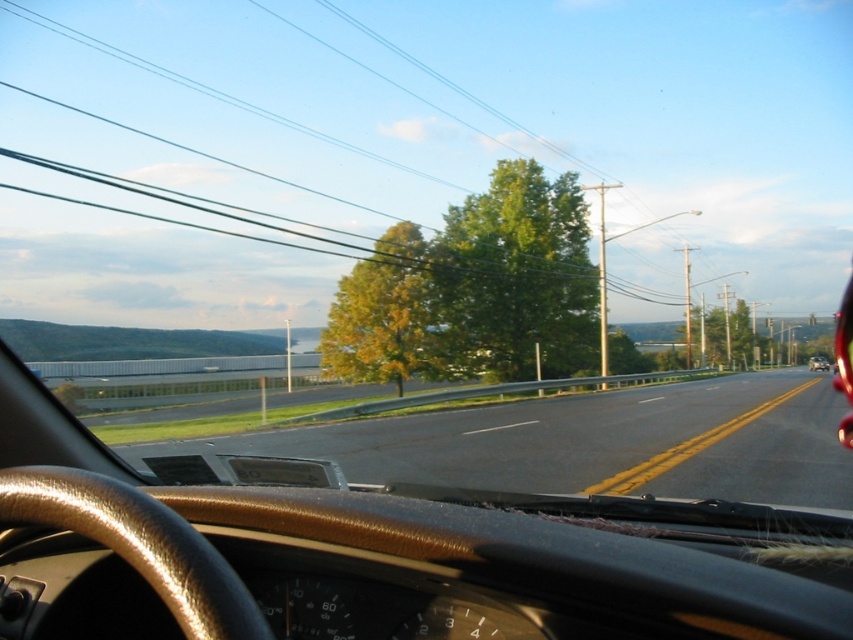
You are driving a car and looking at the scene through the windshield. Where is the black asphalt highway at center located in terms of 2D coordinates?

The black asphalt highway at center is located at the 2D coordinates of point (589, 442).